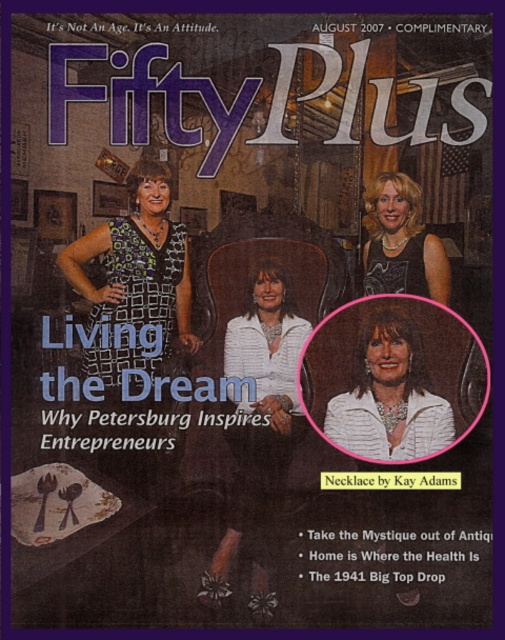
Question: Which object appears farthest from the camera in this image?

Choices:
 (A) printed fabric dress at left
 (B) white textured jacket at center
 (C) white matte jacket at center
 (D) matte black dress at upper right

Answer: (B)

Question: Among these points, which one is farthest from the camera?

Choices:
 (A) (422, 246)
 (B) (221, 563)
 (C) (131, 253)
 (D) (332, 397)

Answer: (D)

Question: Is printed fabric dress at left positioned at the back of matte black dress at upper right?

Choices:
 (A) no
 (B) yes

Answer: (B)

Question: Which of the following is the closest to the observer?

Choices:
 (A) (280, 392)
 (B) (373, 332)
 (C) (132, 317)
 (D) (387, 218)

Answer: (D)

Question: Observing the image, what is the correct spatial positioning of printed fabric dress at left in reference to white textured jacket at center?

Choices:
 (A) right
 (B) left

Answer: (B)

Question: Where is white matte jacket at center located in relation to white textured jacket at center in the image?

Choices:
 (A) left
 (B) right

Answer: (A)